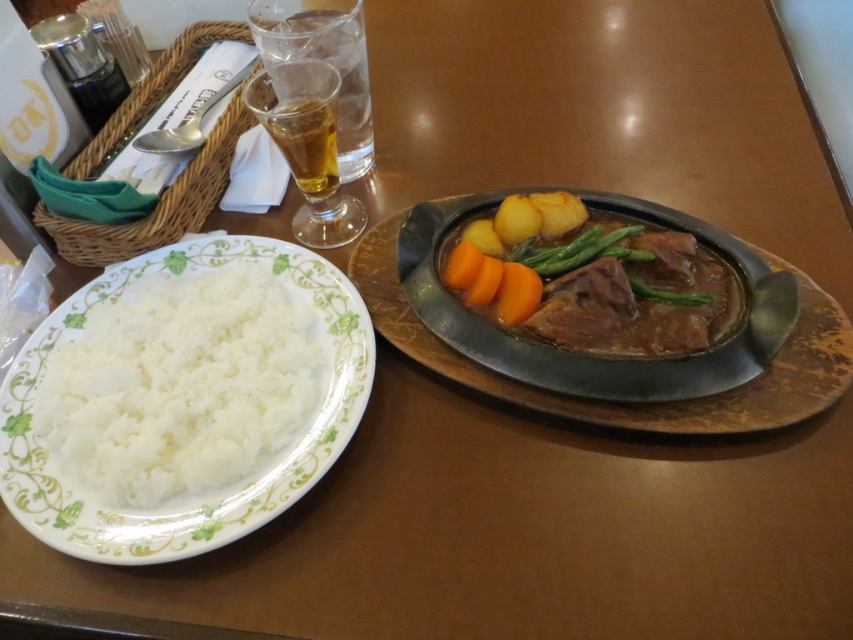
Question: Which object is the farthest from the brown glossy stew at center?

Choices:
 (A) translucent glass beer at upper center
 (B) metallic platter at center right
 (C) white matte rice at left

Answer: (C)

Question: Which object is positioned farthest from the brown glossy stew at center?

Choices:
 (A) metallic platter at center right
 (B) translucent glass beer at upper left
 (C) translucent glass beer at upper center
 (D) green smooth beans at center

Answer: (B)

Question: Does metallic platter at center right appear over translucent glass beer at upper left?

Choices:
 (A) yes
 (B) no

Answer: (B)

Question: From the image, what is the correct spatial relationship of metallic platter at center right in relation to translucent glass beer at upper left?

Choices:
 (A) below
 (B) above

Answer: (A)

Question: Which of these objects is positioned farthest from the metallic platter at center right?

Choices:
 (A) translucent glass beer at upper left
 (B) brown glossy stew at center
 (C) translucent glass beer at upper center
 (D) white matte rice at left

Answer: (A)

Question: Does white matte rice at left lie in front of brown glossy stew at center?

Choices:
 (A) yes
 (B) no

Answer: (A)